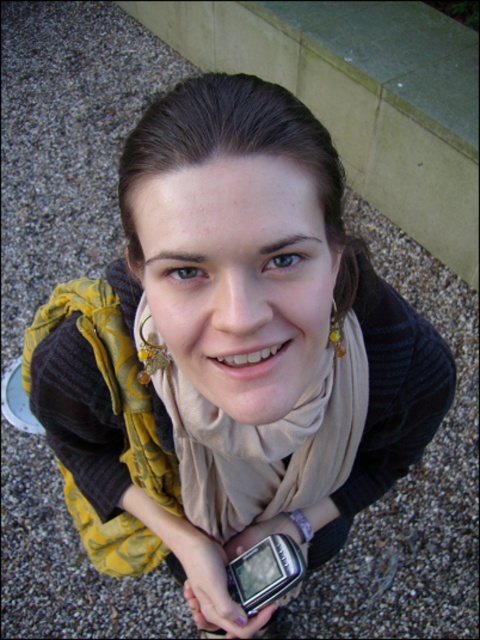
You are standing at a point behind the person in the image. You want to walk towards the point labeled as point (343,390). Will you pass by point (217,605) on your way there?

Yes, because point (343,390) is in front of point (217,605), so walking towards the first point would require passing the second point.

You are a photographer adjusting your camera settings. You notice the beige soft scarf at center and the matte plastic phone at lower center. How far apart are these two items in inches?

The beige soft scarf at center is 6.80 inches from matte plastic phone at lower center.